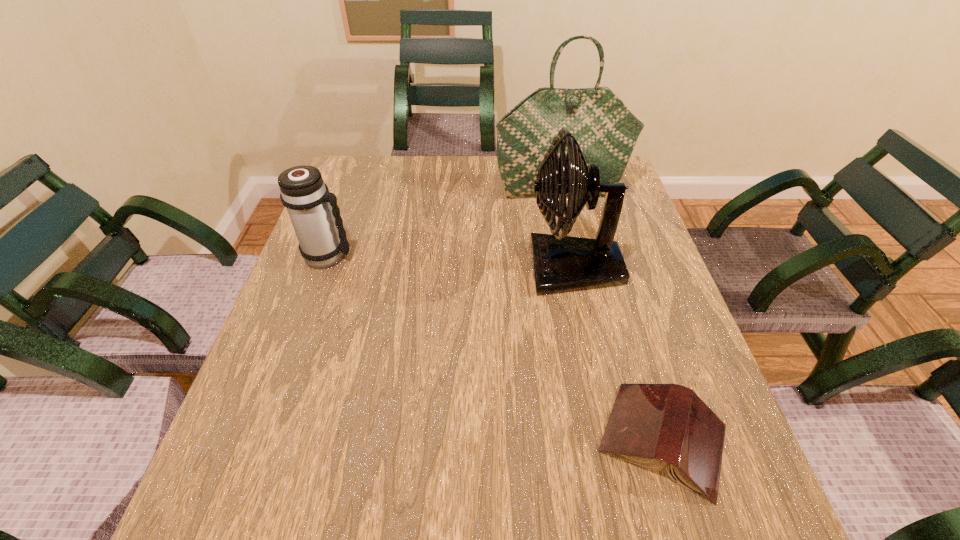
Locate an element on the screen. Image resolution: width=960 pixels, height=540 pixels. object located at the near right corner is located at coordinates (651, 425).

Find the location of a particular element. free region at the far edge is located at coordinates (444, 191).

Find the location of a particular element. The width and height of the screenshot is (960, 540). blank area at the left edge is located at coordinates (297, 436).

Find the location of a particular element. The image size is (960, 540). vacant region at the far left corner is located at coordinates (388, 160).

At what (x,y) coordinates should I click in order to perform the action: click on vacant point located between the fan and the book. Please return your answer as a coordinate pair (x, y). Looking at the image, I should click on (618, 354).

Find the location of a particular element. The image size is (960, 540). empty location between the tallest object and the shortest object is located at coordinates (612, 314).

You are a GUI agent. You are given a task and a screenshot of the screen. Output one action in this format:
    pyautogui.click(x=<x>, y=<y>)
    Task: Click on the free spot between the nearest object and the second tallest object
    
    Given the screenshot: What is the action you would take?
    pyautogui.click(x=618, y=354)

This screenshot has width=960, height=540. Identify the location of free space between the farthest object and the shortest object. (612, 314).

The height and width of the screenshot is (540, 960). In order to click on free space between the tallest object and the nearest object in this screenshot , I will do `click(612, 314)`.

Locate an element on the screen. unoccupied area between the nearest object and the fan is located at coordinates (618, 354).